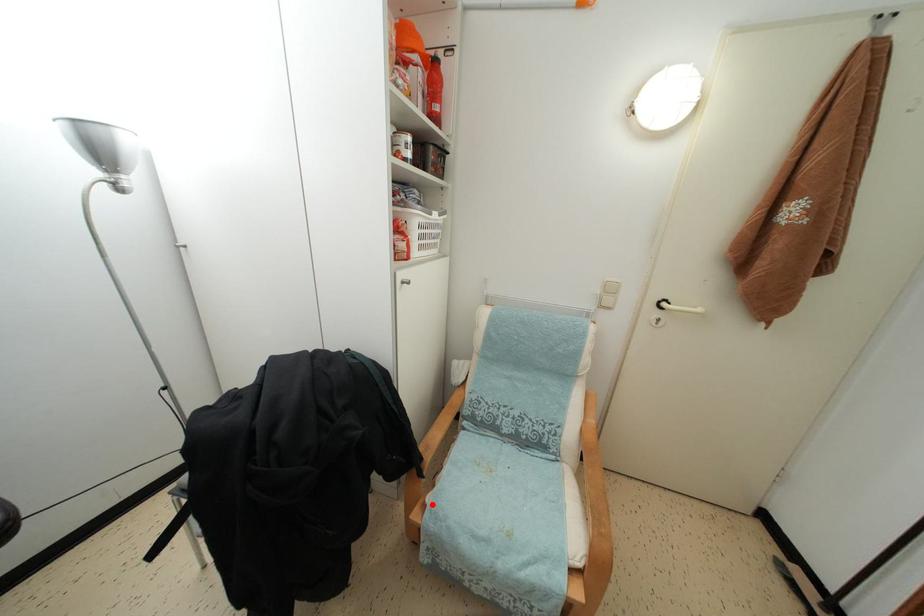
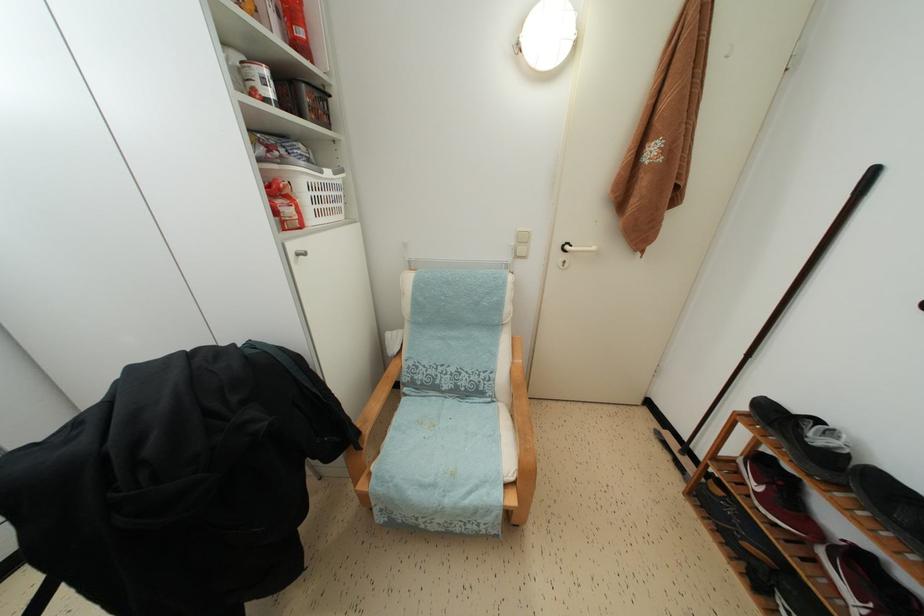
Find the pixel in the second image that matches the highlighted location in the first image.

(377, 472)